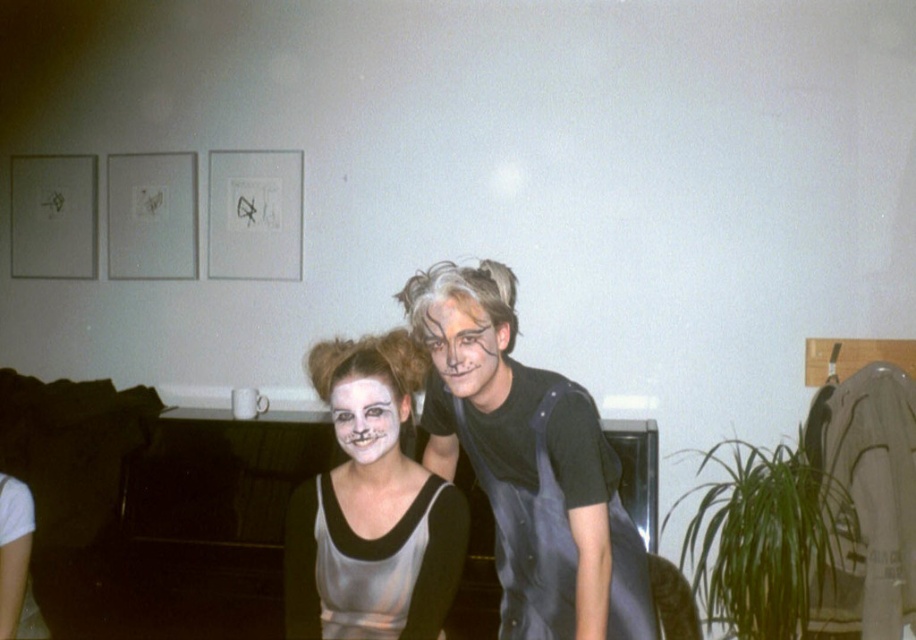
Can you confirm if matte silver dress at center is positioned below matte black face at center?

Correct, matte silver dress at center is located below matte black face at center.

Between matte silver dress at center and matte black face at center, which one appears on the right side from the viewer's perspective?

matte black face at center is more to the right.

Which is behind, point (433, 573) or point (473, 376)?

The point (433, 573) is more distant.

Image resolution: width=916 pixels, height=640 pixels. In order to click on matte silver dress at center in this screenshot , I will do `click(371, 506)`.

Is black matte overalls at center bigger than satin silver dress at center?

Indeed, black matte overalls at center has a larger size compared to satin silver dress at center.

Is point (538, 448) farther from camera compared to point (367, 609)?

No, (538, 448) is in front of (367, 609).

At what (x,y) coordinates should I click in order to perform the action: click on black matte overalls at center. Please return your answer as a coordinate pair (x, y). The height and width of the screenshot is (640, 916). Looking at the image, I should click on (527, 464).

This screenshot has width=916, height=640. I want to click on black matte overalls at center, so pos(527,464).

Is the position of matte silver dress at center less distant than that of satin silver dress at center?

Yes, matte silver dress at center is closer to the viewer.

Does matte silver dress at center appear over satin silver dress at center?

Correct, matte silver dress at center is located above satin silver dress at center.

Where is `matte silver dress at center`? matte silver dress at center is located at coordinates (371, 506).